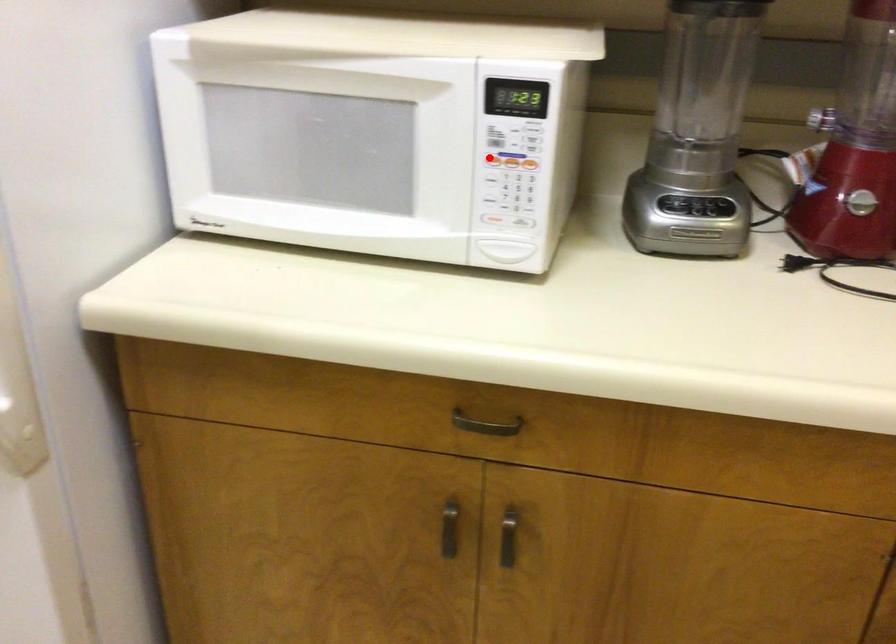
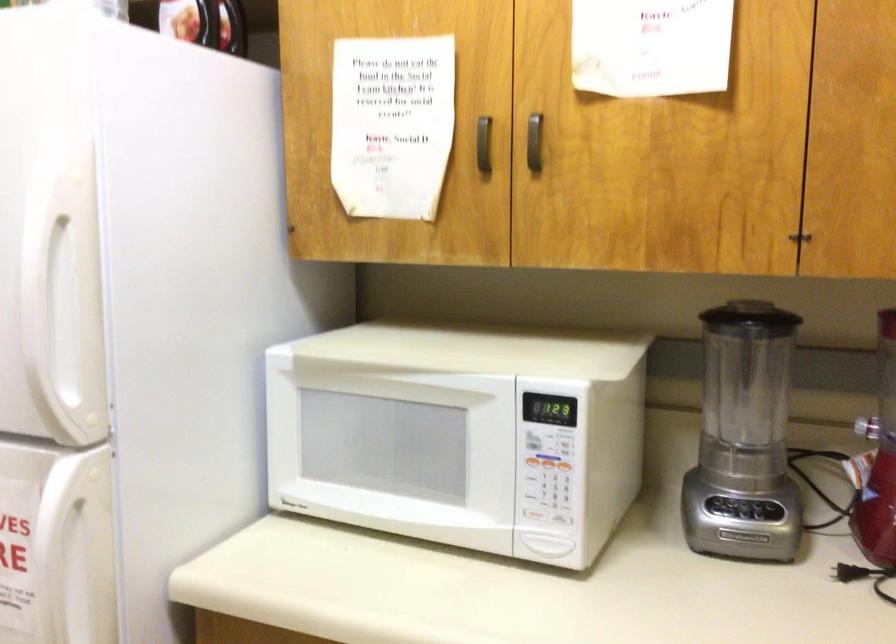
Question: I am providing you with two images of the same scene from different viewpoints. Given a red point in image1, look at the same physical point in image2. Is it:

Choices:
 (A) Closer to the viewpoint
 (B) Farther from the viewpoint

Answer: (B)